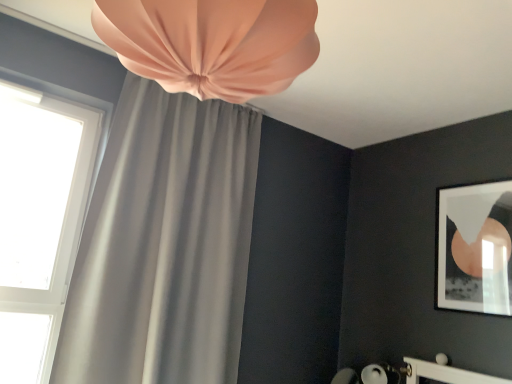
Question: From the image's perspective, is matte black frame at upper right under matte gray curtain at upper left, the first curtain when ordered from front to back?

Choices:
 (A) no
 (B) yes

Answer: (B)

Question: Is matte black frame at upper right aimed at matte gray curtain at upper left, the 2th curtain when ordered from back to front?

Choices:
 (A) no
 (B) yes

Answer: (B)

Question: From the image's perspective, is matte black frame at upper right above matte gray curtain at upper left, the 2th curtain when ordered from back to front?

Choices:
 (A) no
 (B) yes

Answer: (A)

Question: Is matte black frame at upper right positioned before matte gray curtain at upper left, the first curtain when ordered from front to back?

Choices:
 (A) no
 (B) yes

Answer: (A)

Question: Can we say matte black frame at upper right lies outside matte gray curtain at upper left, the 2th curtain when ordered from back to front?

Choices:
 (A) no
 (B) yes

Answer: (B)

Question: Visually, is matte gray curtain at upper left, the 2th curtain when ordered from back to front, positioned to the left or to the right of matte black frame at upper right?

Choices:
 (A) right
 (B) left

Answer: (B)

Question: Relative to matte black frame at upper right, is matte gray curtain at upper left, the first curtain when ordered from front to back, in front or behind?

Choices:
 (A) behind
 (B) front

Answer: (B)

Question: Based on their sizes in the image, would you say matte gray curtain at upper left, the 2th curtain when ordered from back to front, is bigger or smaller than matte black frame at upper right?

Choices:
 (A) big
 (B) small

Answer: (A)

Question: From a real-world perspective, is matte gray curtain at upper left, the 2th curtain when ordered from back to front, physically located above or below matte black frame at upper right?

Choices:
 (A) above
 (B) below

Answer: (A)

Question: From a real-world perspective, is matte gray curtain at upper left, the 1th curtain in the back-to-front sequence, positioned above or below white glass window at upper left?

Choices:
 (A) above
 (B) below

Answer: (A)

Question: From the image's perspective, is matte gray curtain at upper left, the 2th curtain in the front-to-back sequence, above or below white glass window at upper left?

Choices:
 (A) above
 (B) below

Answer: (B)

Question: Looking at the image, does matte gray curtain at upper left, the 1th curtain in the back-to-front sequence, seem bigger or smaller compared to white glass window at upper left?

Choices:
 (A) small
 (B) big

Answer: (B)

Question: In the image, is matte gray curtain at upper left, the 2th curtain in the front-to-back sequence, on the left side or the right side of white glass window at upper left?

Choices:
 (A) left
 (B) right

Answer: (B)

Question: Is matte gray curtain at upper left, the 1th curtain in the back-to-front sequence, to the left or to the right of matte black frame at upper right in the image?

Choices:
 (A) left
 (B) right

Answer: (A)

Question: Considering their positions, is matte gray curtain at upper left, the 1th curtain in the back-to-front sequence, located in front of or behind matte black frame at upper right?

Choices:
 (A) behind
 (B) front

Answer: (B)